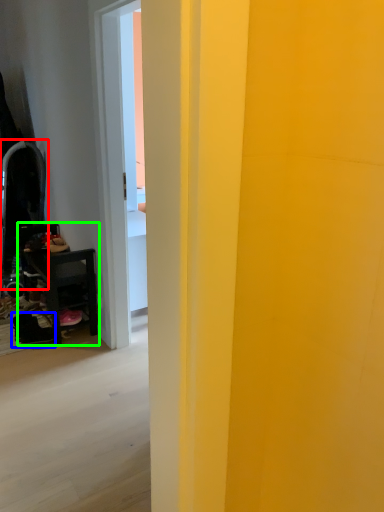
Question: Which object is the closest to the swivel chair (highlighted by a red box)? Choose among these: footwear (highlighted by a blue box) or furniture (highlighted by a green box).

Choices:
 (A) footwear
 (B) furniture

Answer: (B)